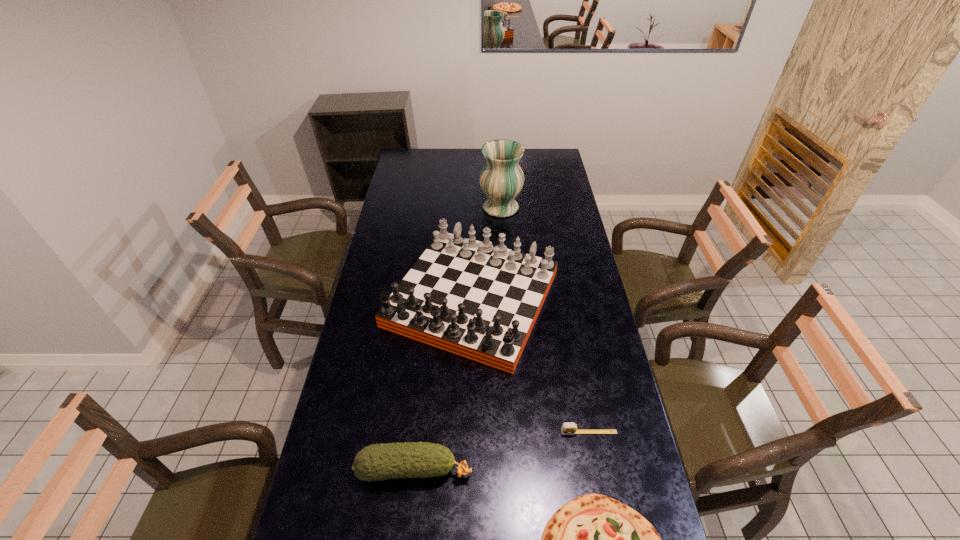
Locate an element on the screen. This screenshot has width=960, height=540. blank area located at the blossom end of the third shortest object is located at coordinates (526, 469).

You are a GUI agent. You are given a task and a screenshot of the screen. Output one action in this format:
    pyautogui.click(x=<x>, y=<y>)
    Task: Click on the free space located at the front of the second shortest object with the tape extended
    This screenshot has height=540, width=960.
    Given the screenshot: What is the action you would take?
    pyautogui.click(x=596, y=472)

You are a GUI agent. You are given a task and a screenshot of the screen. Output one action in this format:
    pyautogui.click(x=<x>, y=<y>)
    Task: Click on the gameboard that is at the left edge
    Image resolution: width=960 pixels, height=540 pixels.
    Given the screenshot: What is the action you would take?
    pyautogui.click(x=474, y=299)

You are a GUI agent. You are given a task and a screenshot of the screen. Output one action in this format:
    pyautogui.click(x=<x>, y=<y>)
    Task: Click on the cucumber at the left edge
    
    Given the screenshot: What is the action you would take?
    pyautogui.click(x=381, y=461)

Where is `gameboard positioned at the right edge`? gameboard positioned at the right edge is located at coordinates (474, 299).

At what (x,y) coordinates should I click in order to perform the action: click on tape measure that is at the right edge. Please return your answer as a coordinate pair (x, y). Image resolution: width=960 pixels, height=540 pixels. Looking at the image, I should click on [x=570, y=428].

Image resolution: width=960 pixels, height=540 pixels. Find the location of `free location at the far edge`. free location at the far edge is located at coordinates pyautogui.click(x=465, y=165).

I want to click on free space at the left edge of the desktop, so click(366, 333).

Identify the location of free space at the right edge of the desktop. (573, 242).

Where is `free space at the far right corner of the desktop`? The image size is (960, 540). free space at the far right corner of the desktop is located at coordinates (556, 159).